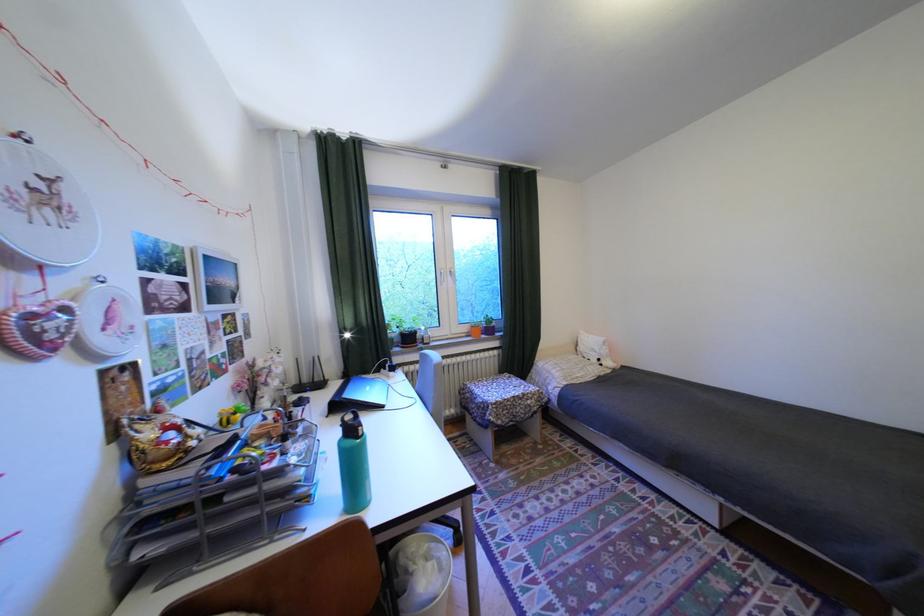
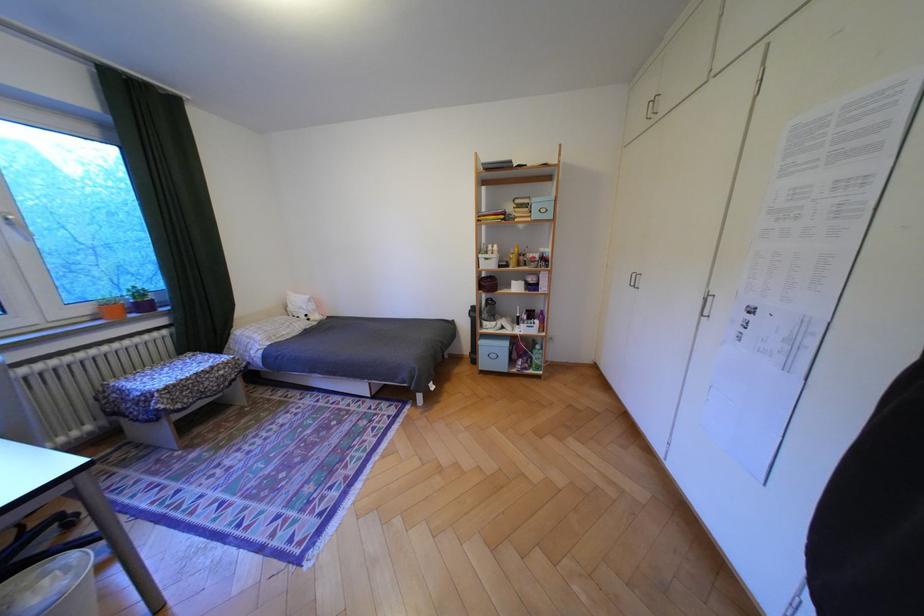
Locate, in the second image, the point that corresponds to point (501, 331) in the first image.

(155, 307)